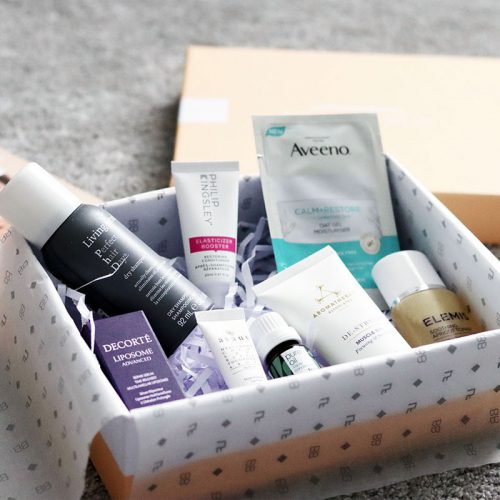
The height and width of the screenshot is (500, 500). What are the coordinates of `grey carpet top of image` in the screenshot? It's located at (90, 92), (60, 27), (266, 26), (424, 16).